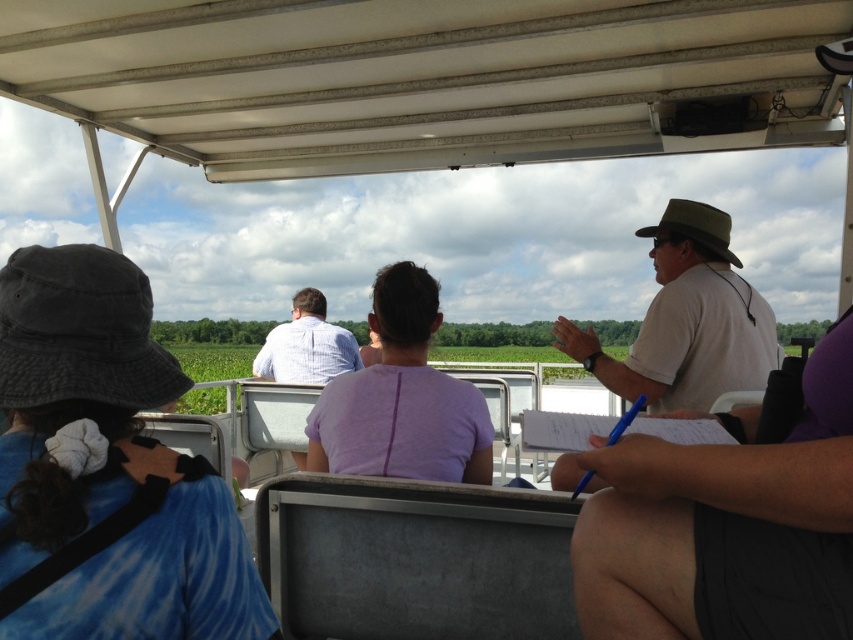
Question: Which point appears closest to the camera in this image?

Choices:
 (A) (338, 449)
 (B) (0, 522)

Answer: (B)

Question: In this image, where is blue tie-dye shirt at upper left located relative to purple matte shirt at center?

Choices:
 (A) left
 (B) right

Answer: (A)

Question: Is blue tie-dye shirt at upper left in front of purple matte shirt at center?

Choices:
 (A) yes
 (B) no

Answer: (A)

Question: Which point is farther to the camera?

Choices:
 (A) blue tie-dye shirt at upper left
 (B) purple matte shirt at center

Answer: (B)

Question: Does blue tie-dye shirt at upper left have a lesser width compared to purple matte shirt at center?

Choices:
 (A) yes
 (B) no

Answer: (A)